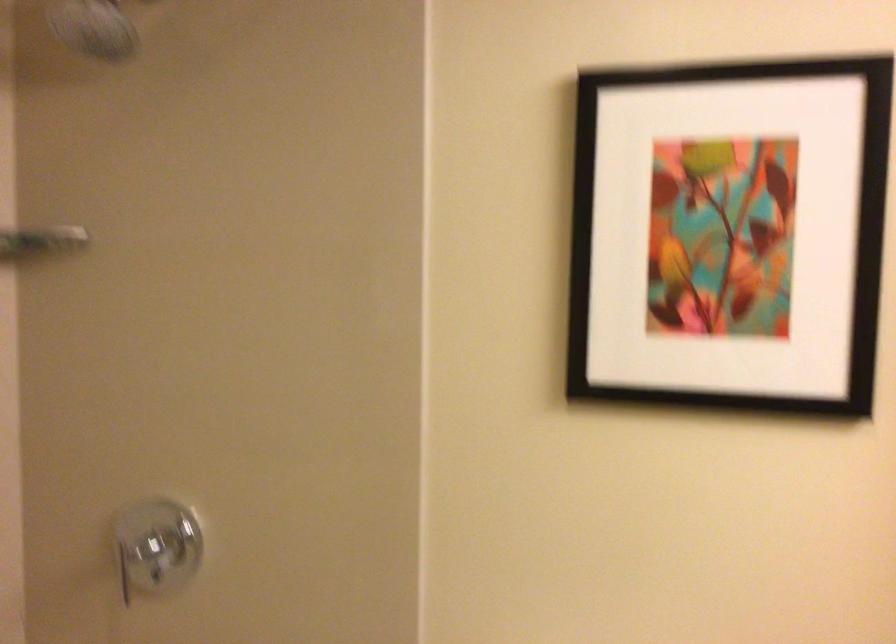
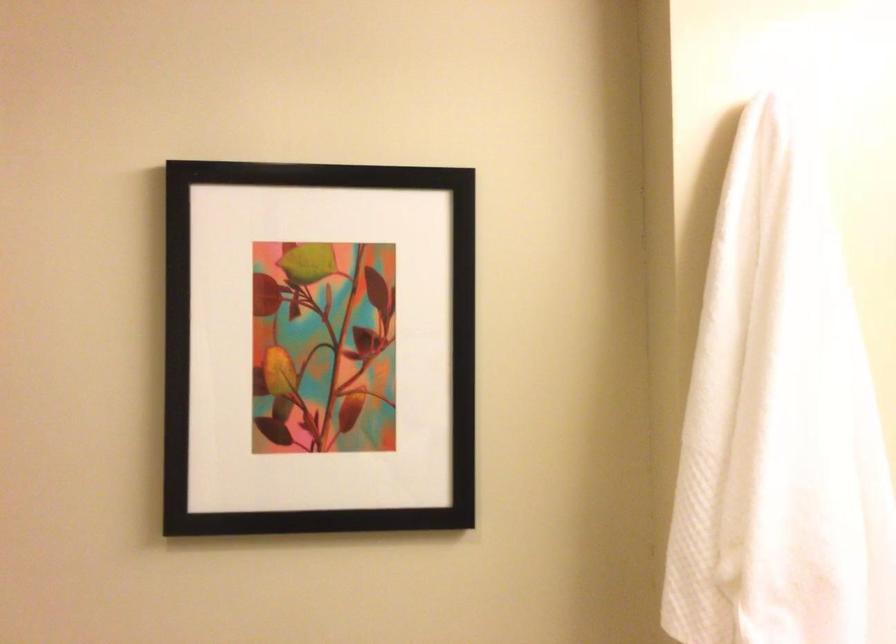
Where in the second image is the point corresponding to pixel 712 239 from the first image?

(317, 348)